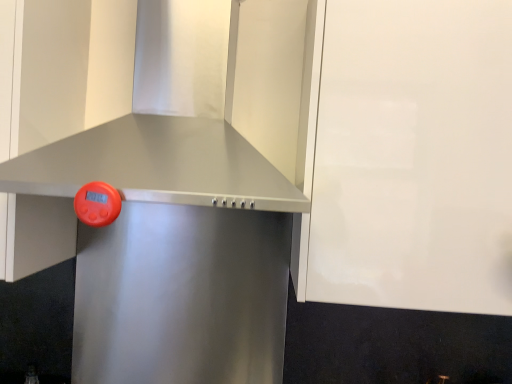
Find the location of a particular element. This screenshot has width=512, height=384. satin metallic range hood at center is located at coordinates (182, 296).

The height and width of the screenshot is (384, 512). What do you see at coordinates (156, 165) in the screenshot?
I see `satin metallic vent at center` at bounding box center [156, 165].

This screenshot has width=512, height=384. I want to click on white glossy cabinet at upper right, so click(413, 157).

Identify the location of satin metallic range hood at center. (182, 296).

From a real-world perspective, relative to satin metallic vent at center, is satin metallic range hood at center vertically above or below?

Clearly, from a real-world perspective, satin metallic range hood at center is below satin metallic vent at center.

Is satin metallic range hood at center at the left side of satin metallic vent at center?

Indeed, satin metallic range hood at center is positioned on the left side of satin metallic vent at center.

Between satin metallic range hood at center and satin metallic vent at center, which one has smaller size?

Smaller between the two is satin metallic range hood at center.

Between point (264, 196) and point (240, 376), which one is positioned in front?

Point (264, 196)

Can you tell me how much satin metallic vent at center and satin metallic range hood at center differ in facing direction?

They differ by 0.293 degrees in their facing directions.

Is satin metallic vent at center behind satin metallic range hood at center?

No, satin metallic vent at center is in front of satin metallic range hood at center.

Which is more to the left, satin metallic vent at center or satin metallic range hood at center?

From the viewer's perspective, satin metallic range hood at center appears more on the left side.

Between white glossy cabinet at upper right and satin metallic range hood at center, which one appears on the right side from the viewer's perspective?

Positioned to the right is white glossy cabinet at upper right.

Is white glossy cabinet at upper right taller than satin metallic range hood at center?

Correct, white glossy cabinet at upper right is much taller as satin metallic range hood at center.

How different are the orientations of white glossy cabinet at upper right and satin metallic range hood at center in degrees?

The facing directions of white glossy cabinet at upper right and satin metallic range hood at center are 0.293 degrees apart.

Is white glossy cabinet at upper right spatially inside satin metallic range hood at center, or outside of it?

white glossy cabinet at upper right is outside satin metallic range hood at center.

From a real-world perspective, is satin metallic vent at center physically located above or below white glossy cabinet at upper right?

In terms of real-world spatial position, satin metallic vent at center is above white glossy cabinet at upper right.

Does point (165, 190) come closer to viewer compared to point (382, 22)?

Yes, point (165, 190) is closer to viewer.

From the picture: Relative to white glossy cabinet at upper right, is satin metallic vent at center in front or behind?

In the image, satin metallic vent at center appears in front of white glossy cabinet at upper right.

Can you confirm if satin metallic vent at center is thinner than white glossy cabinet at upper right?

Incorrect, the width of satin metallic vent at center is not less than that of white glossy cabinet at upper right.

Is white glossy cabinet at upper right beside satin metallic vent at center?

No, white glossy cabinet at upper right is not in contact with satin metallic vent at center.

Considering the relative positions of white glossy cabinet at upper right and satin metallic vent at center in the image provided, is white glossy cabinet at upper right to the right of satin metallic vent at center from the viewer's perspective?

Correct, you'll find white glossy cabinet at upper right to the right of satin metallic vent at center.

Where is `vent lying above the white glossy cabinet at upper right (from the image's perspective)`? This screenshot has height=384, width=512. vent lying above the white glossy cabinet at upper right (from the image's perspective) is located at coordinates (156, 165).

Is satin metallic range hood at center to the left or to the right of white glossy cabinet at upper right in the image?

In the image, satin metallic range hood at center appears on the left side of white glossy cabinet at upper right.

Is satin metallic range hood at center positioned far away from white glossy cabinet at upper right?

They are positioned close to each other.

Consider the image. From a real-world perspective, is satin metallic range hood at center above or below white glossy cabinet at upper right?

In terms of real-world spatial position, satin metallic range hood at center is below white glossy cabinet at upper right.

Is satin metallic range hood at center shorter than white glossy cabinet at upper right?

Yes, satin metallic range hood at center is shorter than white glossy cabinet at upper right.

Locate an element on the screen. vent that appears above the satin metallic range hood at center (from a real-world perspective) is located at coordinates (156, 165).

This screenshot has width=512, height=384. I want to click on appliance that is under the satin metallic vent at center (from a real-world perspective), so click(182, 296).

Looking at the image, which one is located closer to satin metallic range hood at center, satin metallic vent at center or white glossy cabinet at upper right?

satin metallic vent at center is positioned closer to the anchor satin metallic range hood at center.

From the image, which object appears to be nearer to satin metallic range hood at center, white glossy cabinet at upper right or satin metallic vent at center?

satin metallic vent at center is positioned closer to the anchor satin metallic range hood at center.

Considering their positions, is white glossy cabinet at upper right positioned closer to satin metallic vent at center than satin metallic range hood at center?

white glossy cabinet at upper right is positioned closer to the anchor satin metallic vent at center.

From the image, which object appears to be farther from white glossy cabinet at upper right, satin metallic range hood at center or satin metallic vent at center?

satin metallic range hood at center lies further to white glossy cabinet at upper right than the other object.

Based on their spatial positions, is satin metallic vent at center or satin metallic range hood at center further from white glossy cabinet at upper right?

Among the two, satin metallic range hood at center is located further to white glossy cabinet at upper right.

When comparing their distances from satin metallic vent at center, does satin metallic range hood at center or white glossy cabinet at upper right seem closer?

white glossy cabinet at upper right is closer to satin metallic vent at center.

Where is `vent located between satin metallic range hood at center and white glossy cabinet at upper right in the left-right direction`? vent located between satin metallic range hood at center and white glossy cabinet at upper right in the left-right direction is located at coordinates (156, 165).